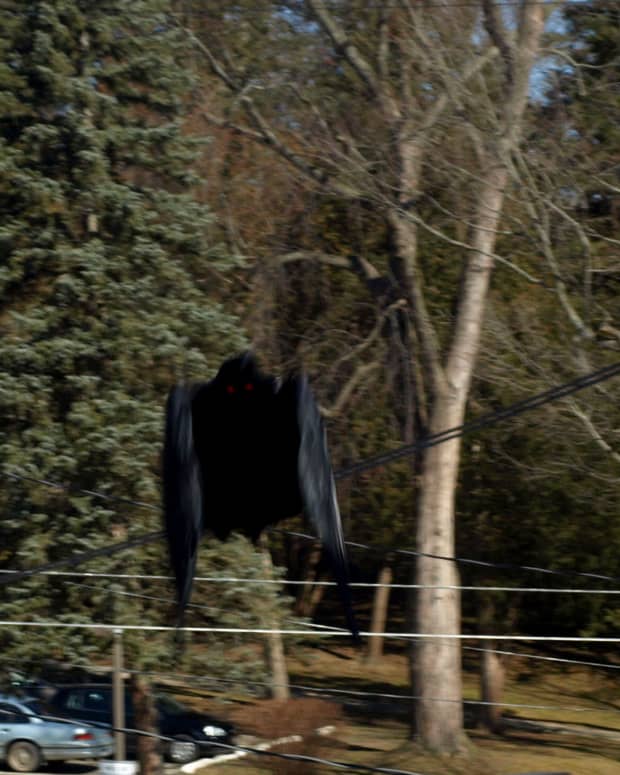
At what (x,y) coordinates should I click in order to perform the action: click on lights. Please return your answer as a coordinate pair (x, y). Looking at the image, I should click on (81, 735), (209, 728).